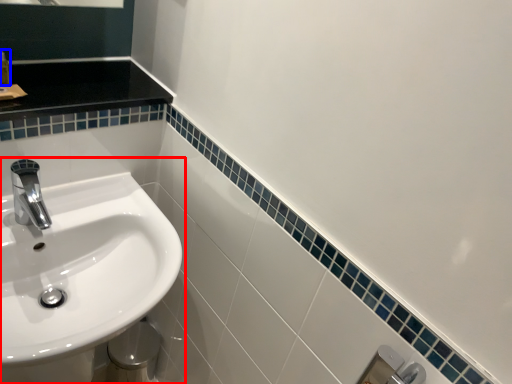
Question: Which object is closer to the camera taking this photo, sink (highlighted by a red box) or toiletry (highlighted by a blue box)?

Choices:
 (A) sink
 (B) toiletry

Answer: (A)